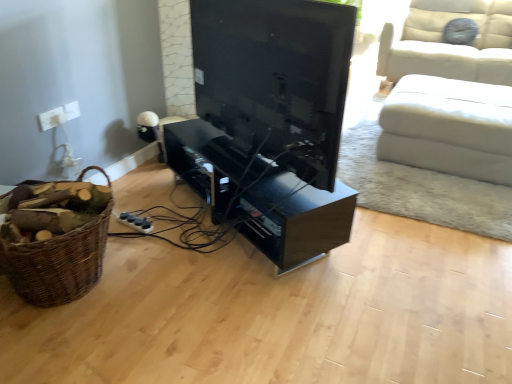
Find the location of a particular element. This screenshot has width=512, height=384. free space in front of black glossy entertainment center at center is located at coordinates (322, 321).